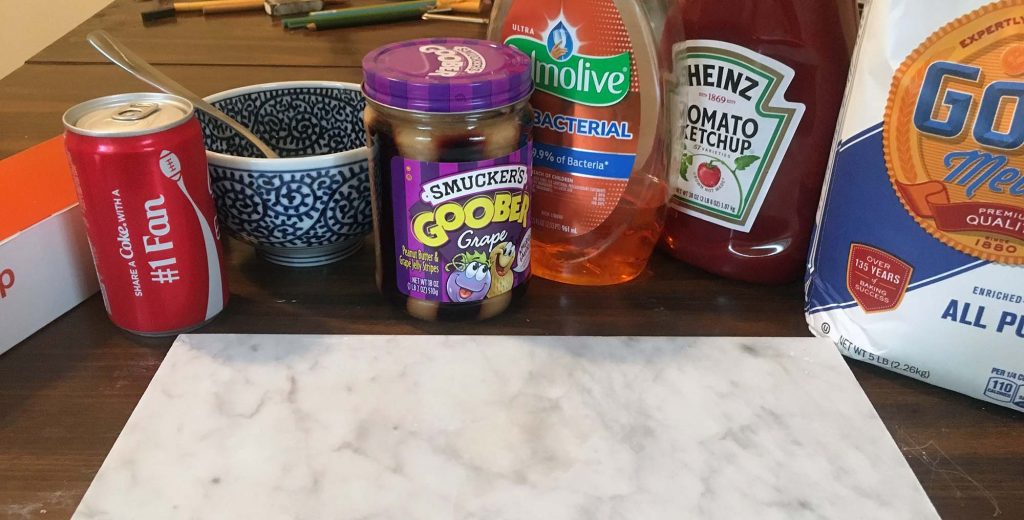
At what (x,y) coordinates should I click in order to perform the action: click on soap. Please return your answer as a coordinate pair (x, y). This screenshot has height=520, width=1024. Looking at the image, I should click on point(643,215).